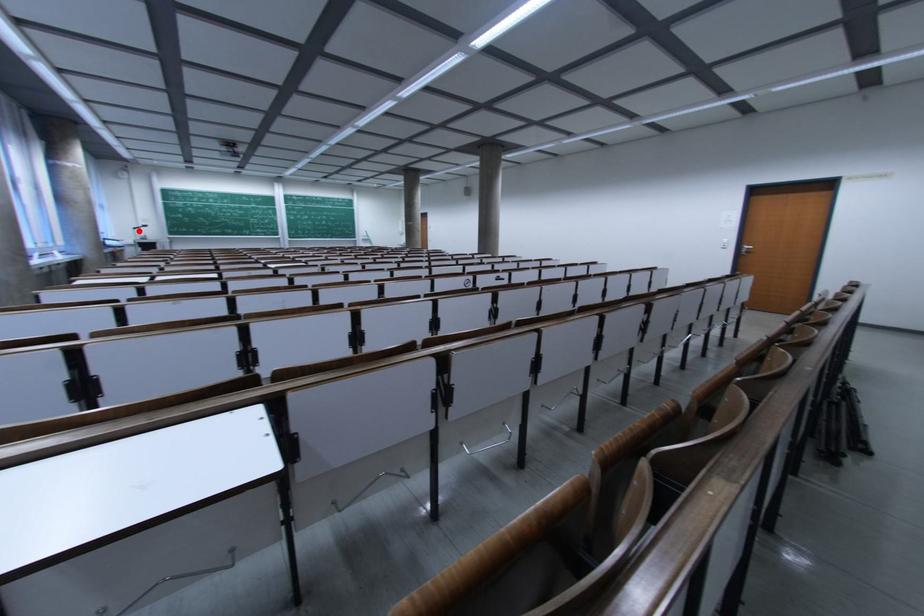
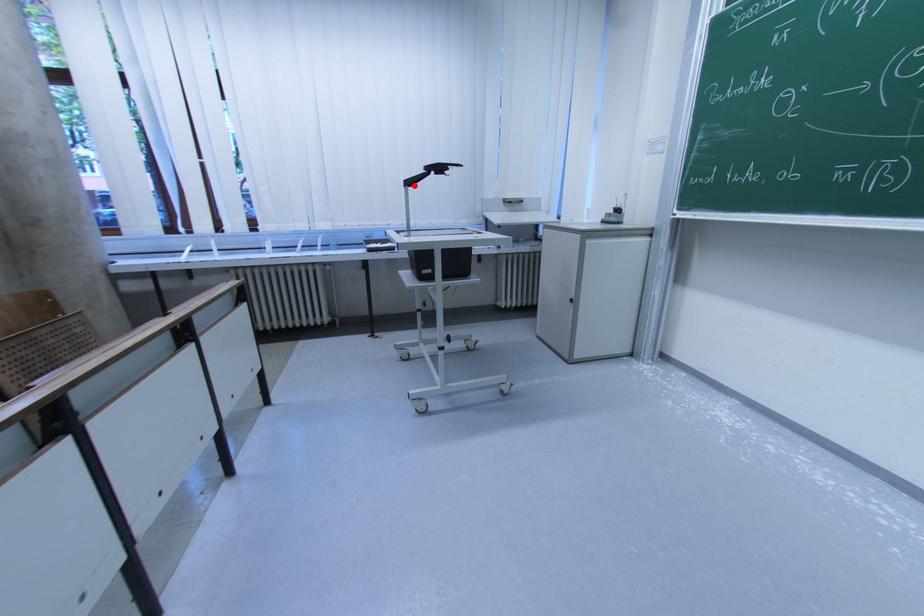
I am providing you with two images of the same scene from different viewpoints. A red point is marked on the first image and another point is marked on the second image. Does the point marked in image1 correspond to the same location as the one in image2?

Yes